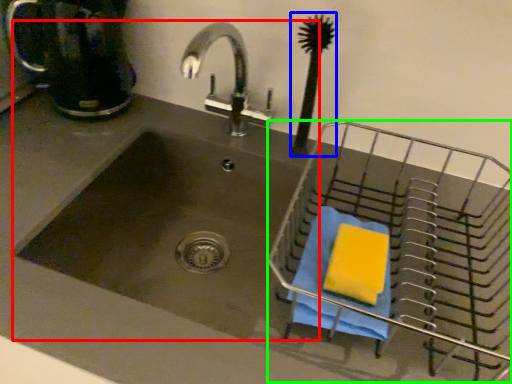
Question: Which object is the farthest from sink (highlighted by a red box)? Choose among these: brush (highlighted by a blue box) or basket (highlighted by a green box).

Choices:
 (A) brush
 (B) basket

Answer: (A)